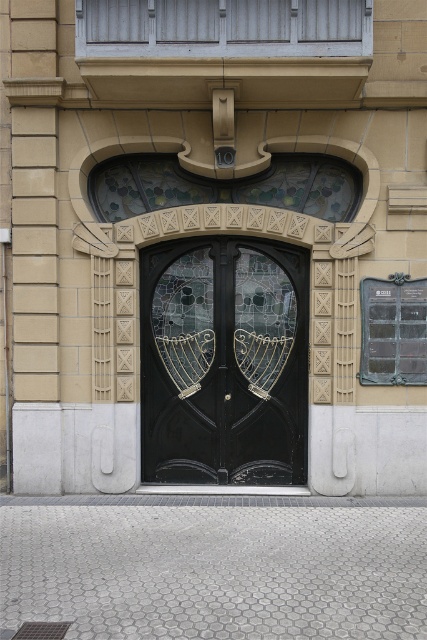
Question: Which point is farther to the camera?

Choices:
 (A) transparent glass at center
 (B) stained glass doors at center

Answer: (B)

Question: Is stained glass doors at center below transparent glass at center?

Choices:
 (A) yes
 (B) no

Answer: (A)

Question: Among these objects, which one is nearest to the camera?

Choices:
 (A) stained glass doors at center
 (B) transparent glass at center

Answer: (B)

Question: From the image, what is the correct spatial relationship of stained glass doors at center in relation to transparent glass at center?

Choices:
 (A) above
 (B) below

Answer: (B)

Question: Can you confirm if stained glass doors at center is bigger than transparent glass at center?

Choices:
 (A) no
 (B) yes

Answer: (B)